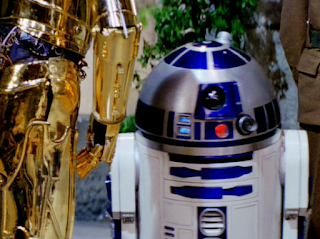
At what (x,y) coordinates should I click in order to perform the action: click on knob. Please return your answer as a coordinate pair (x, y). This screenshot has height=239, width=320. Looking at the image, I should click on (249, 121).